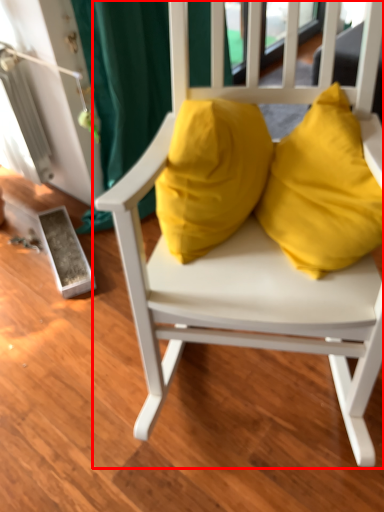
Question: From the image's perspective, where is chair (annotated by the red box) located relative to pillow?

Choices:
 (A) below
 (B) above

Answer: (A)